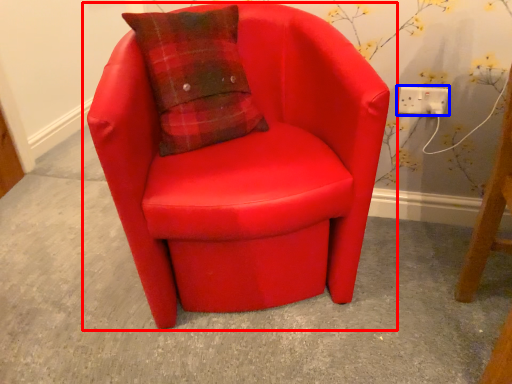
Question: Which object is further to the camera taking this photo, chair (highlighted by a red box) or electric outlet (highlighted by a blue box)?

Choices:
 (A) chair
 (B) electric outlet

Answer: (B)